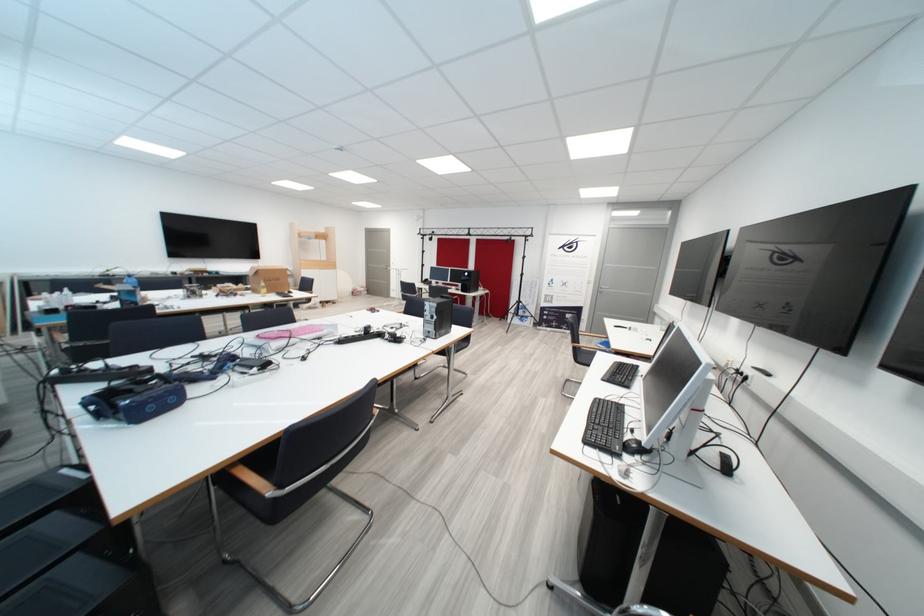
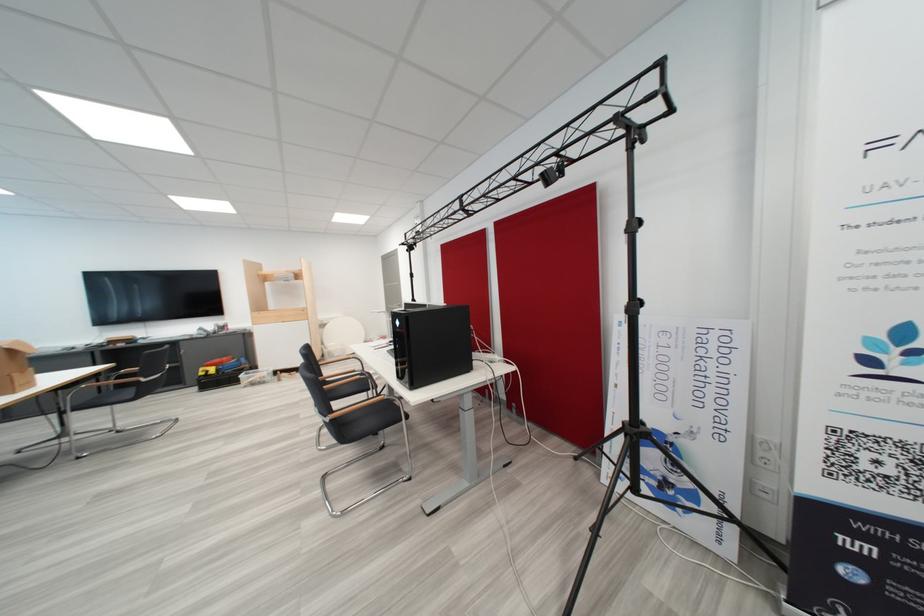
Find the pixel in the second image that matches (477,276) in the first image.

(407, 325)